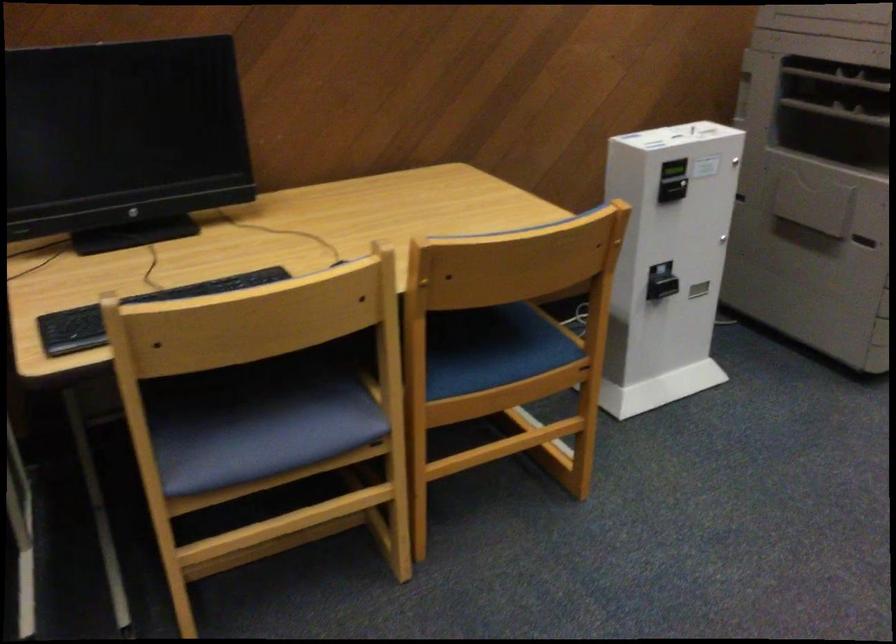
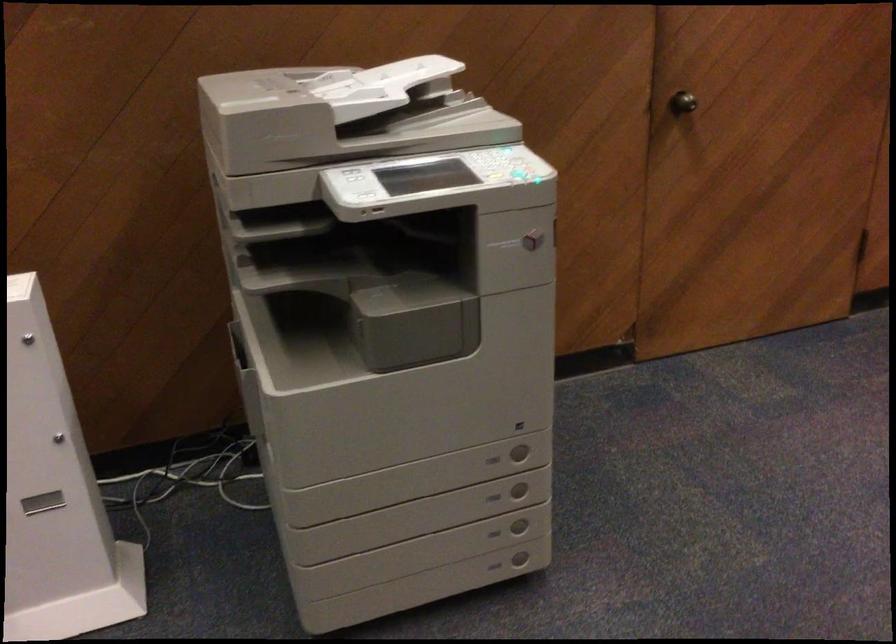
The images are taken continuously from a first-person perspective. In which direction are you moving?

The cameraman walked toward right, forward.